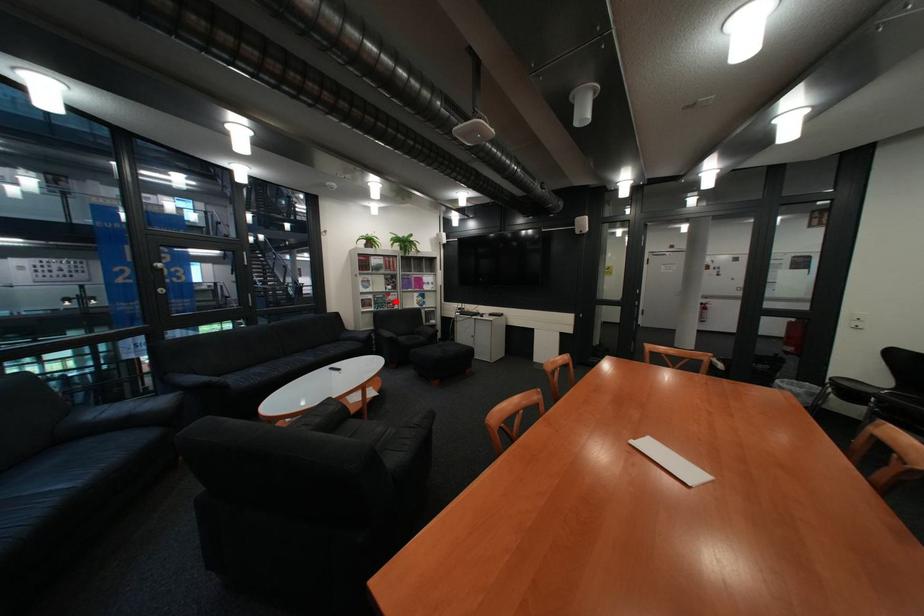
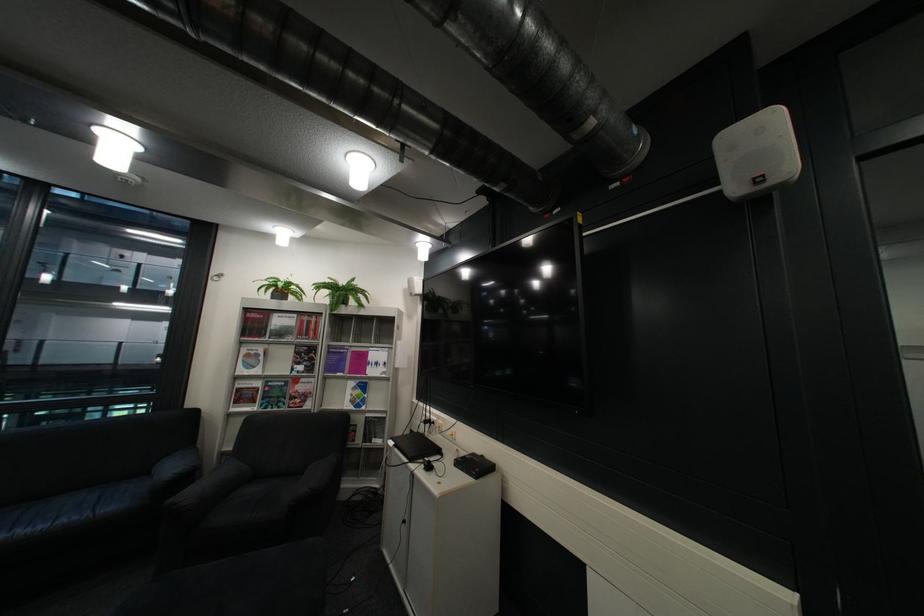
Question: I am providing you with two images of the same scene from different viewpoints. Given a red point in image1, look at the same physical point in image2. Is it:

Choices:
 (A) Closer to the viewpoint
 (B) Farther from the viewpoint

Answer: (B)